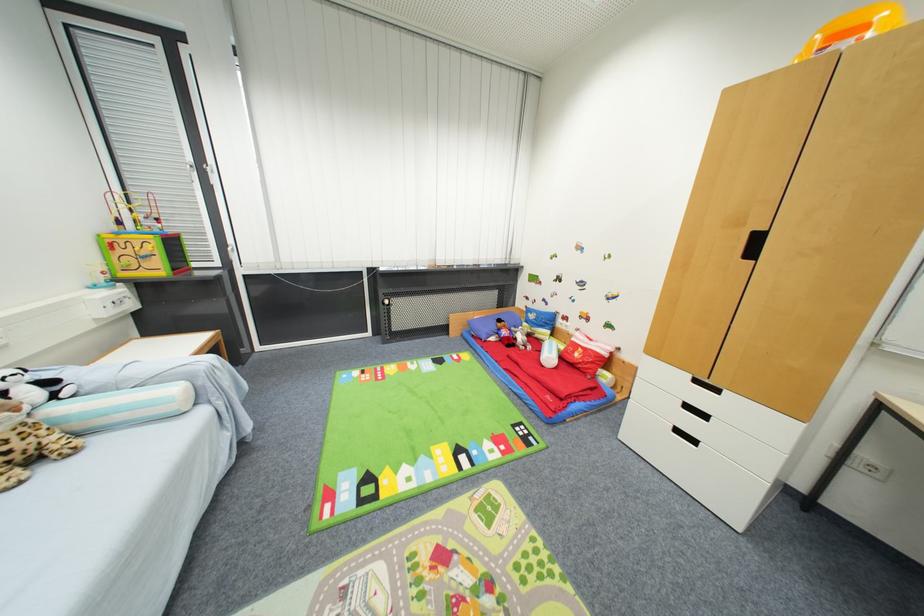
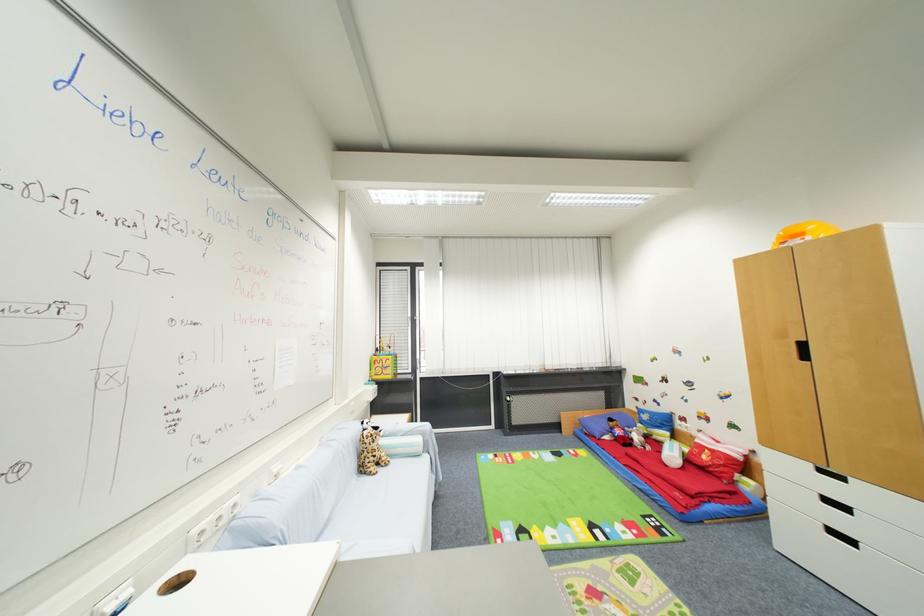
Locate, in the second image, the point that corresponds to [695,378] in the first image.

(816, 467)